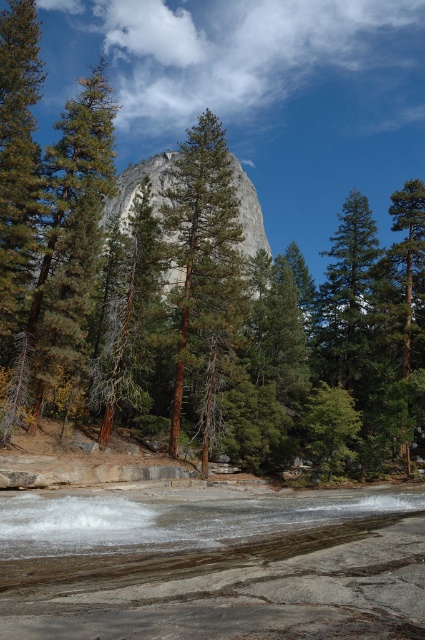
In the scene shown: Can you confirm if green rough textured tree at center is smaller than green matte tree at center?

No.

Can you confirm if green rough textured tree at center is positioned to the left of green matte tree at center?

Incorrect, green rough textured tree at center is not on the left side of green matte tree at center.

Identify the location of green rough textured tree at center. The width and height of the screenshot is (425, 640). (204, 259).

Can you confirm if clear water at lower center is smaller than gray granite mountain at center?

Indeed, clear water at lower center has a smaller size compared to gray granite mountain at center.

Does clear water at lower center have a greater height compared to gray granite mountain at center?

No.

Is point (138, 570) closer to viewer compared to point (130, 188)?

Yes, it is.

Find the location of a particular element. Image resolution: width=425 pixels, height=640 pixels. clear water at lower center is located at coordinates (176, 531).

The image size is (425, 640). In order to click on green textured tree at center in this screenshot , I will do `click(70, 228)`.

Does point (67, 339) come farther from viewer compared to point (99, 353)?

No, (67, 339) is closer to viewer.

Between point (87, 150) and point (99, 364), which one is positioned in front?

Point (87, 150) is in front.

Where is `green textured tree at center`? The height and width of the screenshot is (640, 425). green textured tree at center is located at coordinates (70, 228).